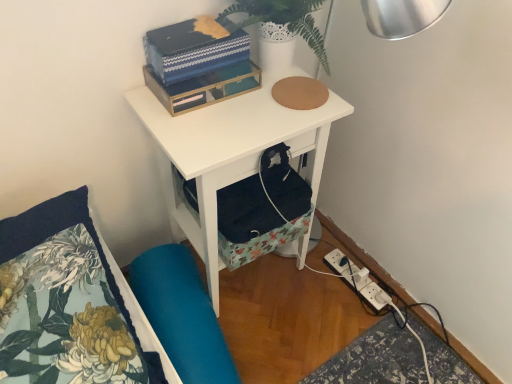
This screenshot has height=384, width=512. What are the coordinates of `vacant space behind white plastic power strip at lower right` in the screenshot? It's located at (342, 251).